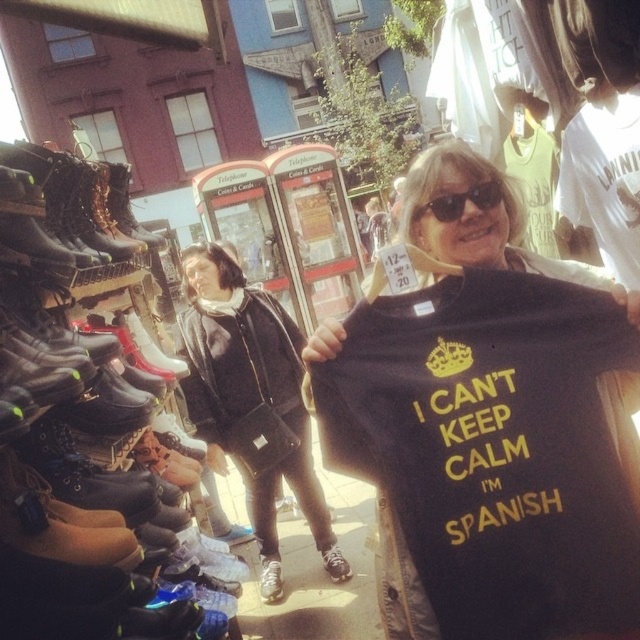
You are a photographer trying to capture a closeup of the black plastic sunglasses at upper center and the white leather sneaker at lower center. Since you want both items to be clearly visible in the photo, which object should you focus on first to ensure proper focus?

The black plastic sunglasses at upper center has a lesser height compared to the white leather sneaker at lower center. Therefore, you should focus on the white leather sneaker at lower center first, as it is taller and might require more precise focusing to capture details.